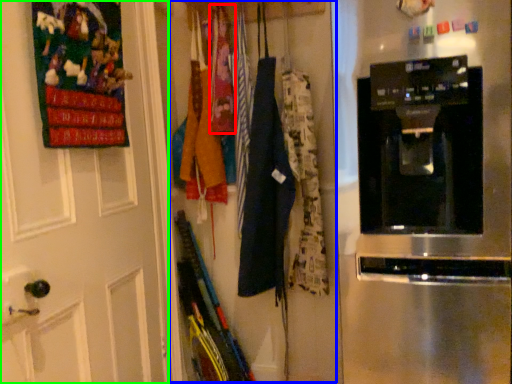
Question: Which object is positioned closest to clothing (highlighted by a red box)? Select from closet (highlighted by a blue box) and door (highlighted by a green box).

Choices:
 (A) closet
 (B) door

Answer: (A)